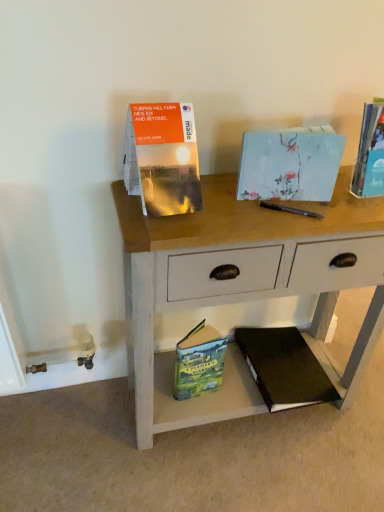
Image resolution: width=384 pixels, height=512 pixels. What are the coordinates of `free spot to the right of matte orange map at upper left, the third paperback book positioned from the bottom` in the screenshot? It's located at (237, 213).